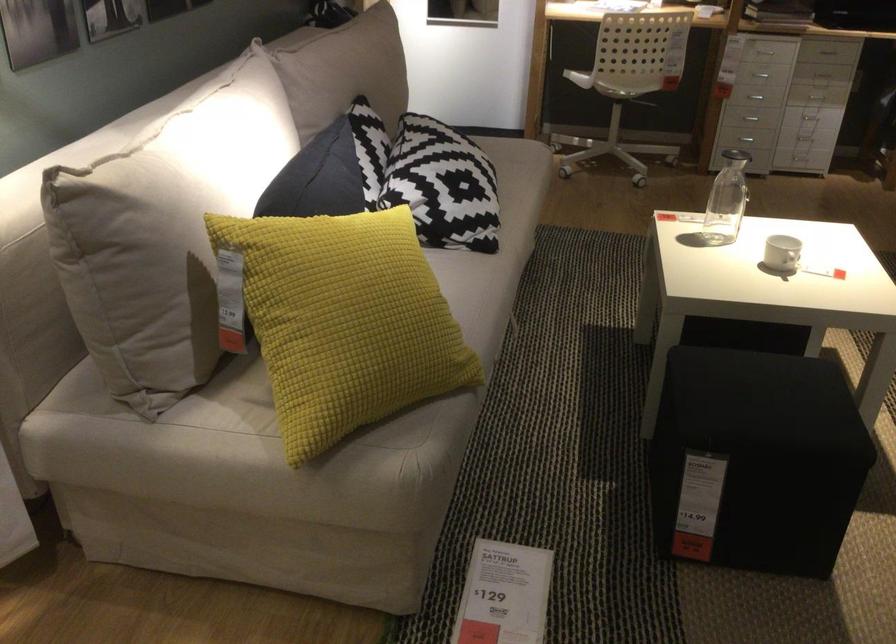
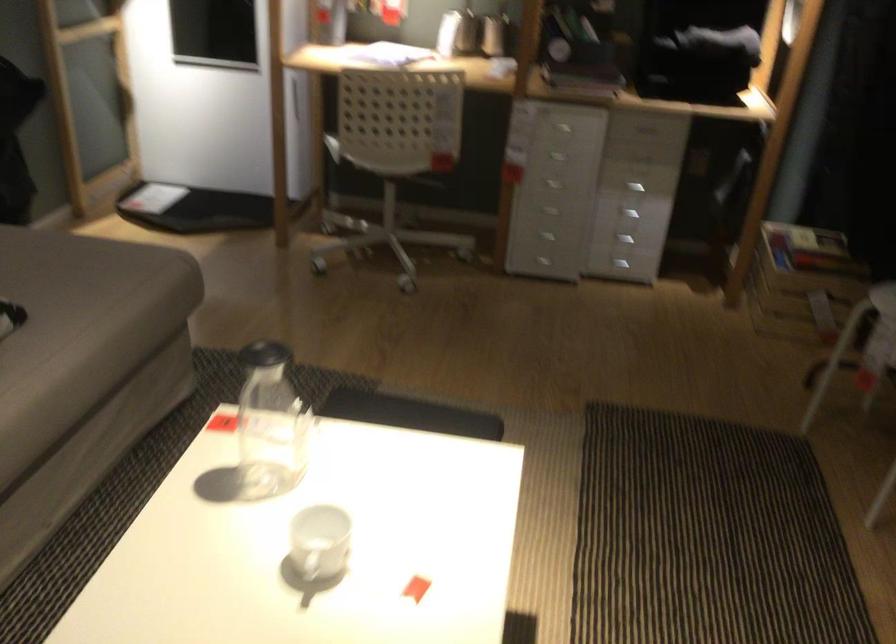
Based on the photo, the images are taken continuously from a first-person perspective. In which direction are you moving?

The cameraman walked toward right, forward.